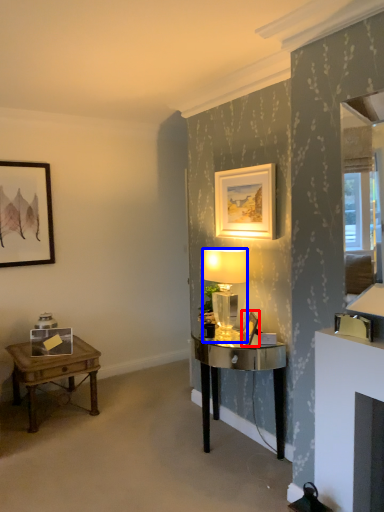
Question: Which of the following is the closest to the observer, picture frame (highlighted by a red box) or lamp (highlighted by a blue box)?

Choices:
 (A) picture frame
 (B) lamp

Answer: (A)